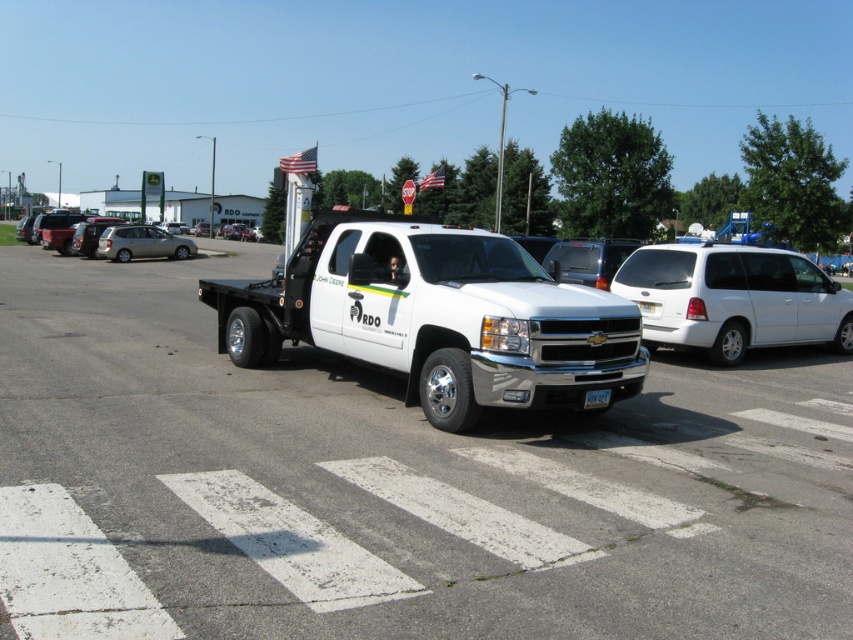
Question: Which object appears farthest from the camera in this image?

Choices:
 (A) satin silver sedan at left
 (B) white glossy truck at center
 (C) white glossy minivan at center
 (D) silver metallic sedan at center

Answer: (D)

Question: Can you confirm if white glossy truck at center is positioned to the left of white glossy minivan at center?

Choices:
 (A) yes
 (B) no

Answer: (A)

Question: Is white glossy tow truck at center below satin silver sedan at left?

Choices:
 (A) no
 (B) yes

Answer: (B)

Question: Does white glossy tow truck at center appear under white plastic license plate at center?

Choices:
 (A) yes
 (B) no

Answer: (B)

Question: Estimate the real-world distances between objects in this image. Which object is closer to the satin silver sedan at left?

Choices:
 (A) silver metallic sedan at center
 (B) white glossy minivan at center

Answer: (A)

Question: Which object is farther from the camera taking this photo?

Choices:
 (A) white glossy minivan at center
 (B) satin silver sedan at left

Answer: (B)